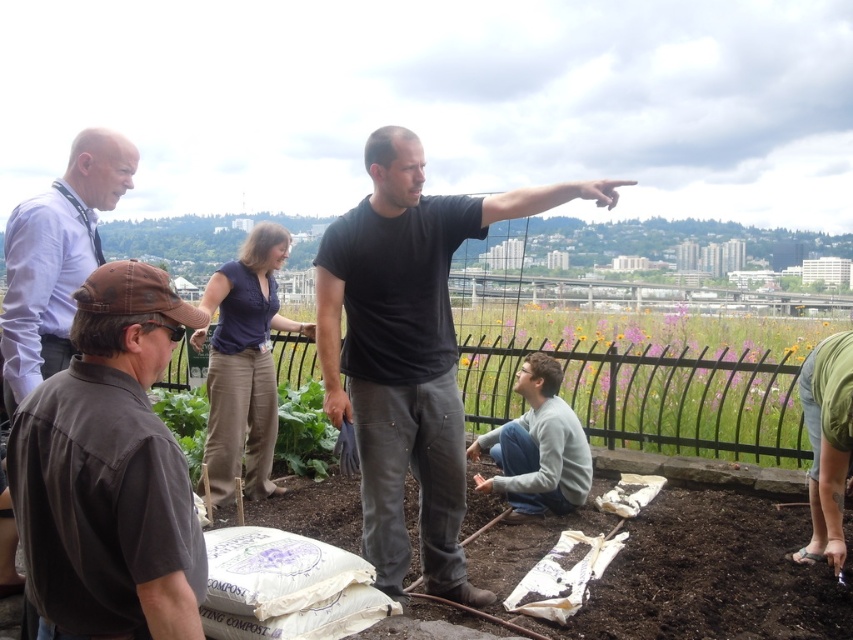
Question: Does brown fabric cap at lower left appear over gray fleece sweater at center?

Choices:
 (A) no
 (B) yes

Answer: (B)

Question: Does brown fabric cap at lower left have a lesser width compared to black matte shirt at center?

Choices:
 (A) no
 (B) yes

Answer: (B)

Question: Which point appears closest to the camera in this image?

Choices:
 (A) (444, 294)
 (B) (550, 406)

Answer: (A)

Question: Based on their relative distances, which object is farther from the black matte shirt at center?

Choices:
 (A) brown fabric cap at lower left
 (B) light blue shirt at upper left

Answer: (A)

Question: Is black matte shirt at center closer to camera compared to gray fleece sweater at center?

Choices:
 (A) yes
 (B) no

Answer: (A)

Question: Among these points, which one is farthest from the camera?

Choices:
 (A) (132, 442)
 (B) (364, 525)

Answer: (B)